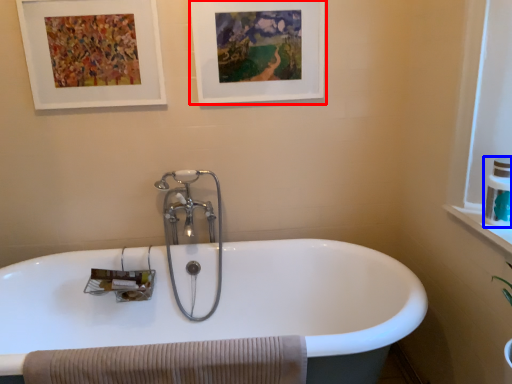
Question: Which of the following is the farthest to the observer, picture frame (highlighted by a red box) or toiletry (highlighted by a blue box)?

Choices:
 (A) picture frame
 (B) toiletry

Answer: (A)